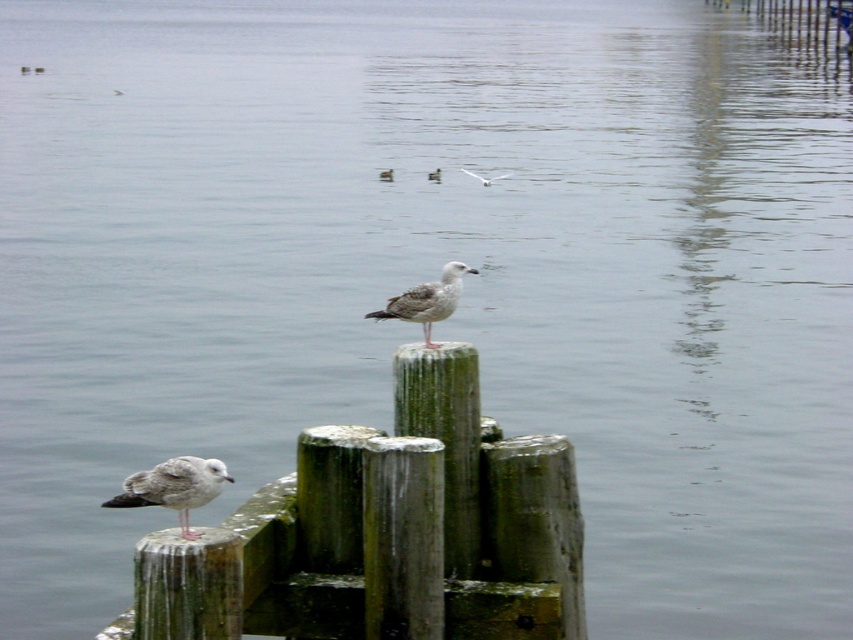
You are a photographer trying to capture the green mossy wood post at lower left and the gray feathered bird at center in the same frame. Which object is positioned higher in the image?

The green mossy wood post at lower left is taller than the gray feathered bird at center, so the green mossy wood post at lower left is positioned higher in the image.

You are a photographer aiming to capture the gray feathered bird at center perched on the green mossy post at center. Based on the scene description, can you confirm if the bird is currently sitting on the post?

Yes, the gray feathered bird at center is perched on the green mossy post at center since the post is positioned under the bird.

You are a birdwatcher observing two white feathered birds in the waterfront scene. Which of the two birds, the white feathered bird at upper center or the white feathered bird at center, is positioned higher up in the image?

The white feathered bird at upper center is positioned higher up in the image compared to the white feathered bird at center.